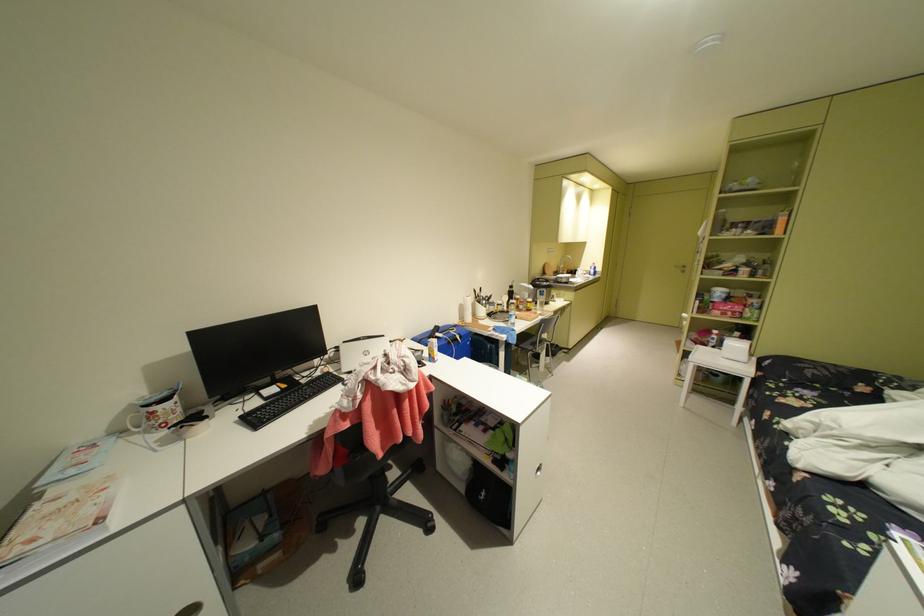
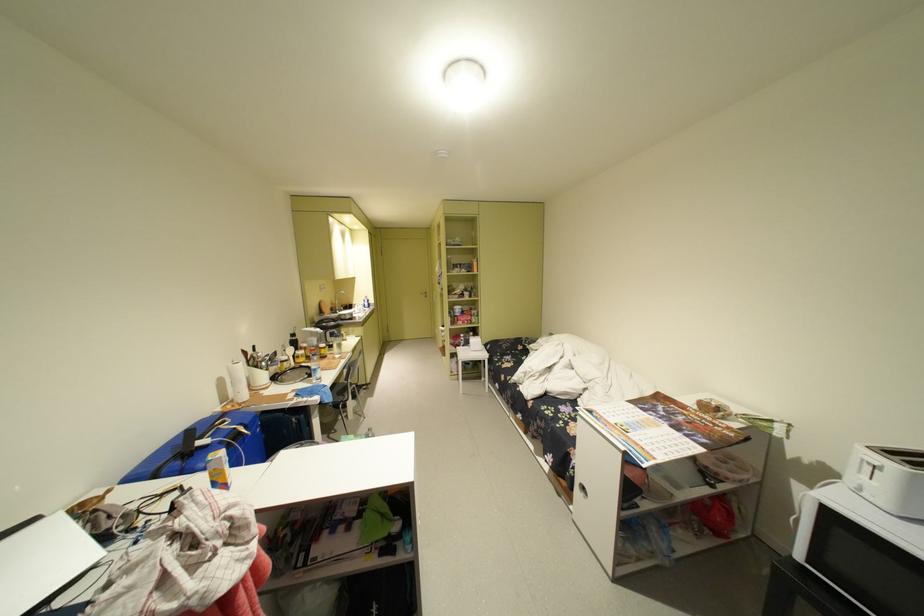
In the second image, find the point that corresponds to pixel 517 320 in the first image.

(318, 377)